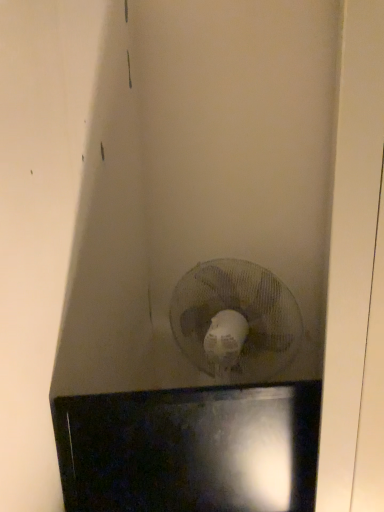
Locate an element on the screen. white plastic fan at center is located at coordinates (235, 321).

What is the approximate width of white plastic fan at center?

white plastic fan at center is 8.53 inches in width.

Image resolution: width=384 pixels, height=512 pixels. Describe the element at coordinates (235, 321) in the screenshot. I see `white plastic fan at center` at that location.

Locate an element on the screen. white plastic fan at center is located at coordinates pos(235,321).